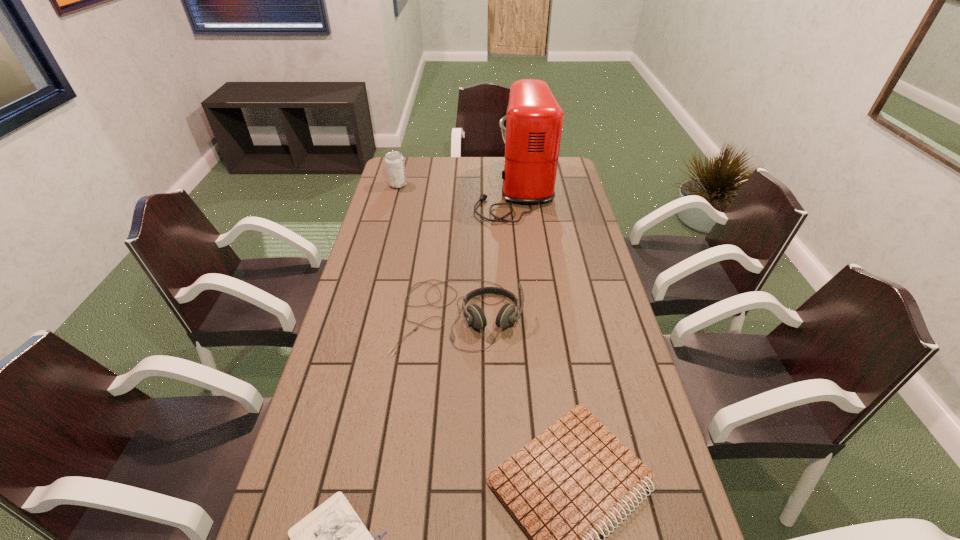
Identify the location of vacant space in between the third farthest object and the kitchen mixer. (487, 252).

The height and width of the screenshot is (540, 960). Find the location of `free spot between the third nearest object and the fourth shortest object`. free spot between the third nearest object and the fourth shortest object is located at coordinates (428, 250).

The image size is (960, 540). I want to click on empty space that is in between the fourth shortest object and the kitchen mixer, so click(x=456, y=187).

Locate an element on the screen. Image resolution: width=960 pixels, height=540 pixels. object that ranks as the third closest to the shortest object is located at coordinates (531, 130).

Identify which object is the fourth nearest to the kitchen mixer. Please provide its 2D coordinates. Your answer should be formatted as a tuple, i.e. [(x, y)], where the tuple contains the x and y coordinates of a point satisfying the conditions above.

[(332, 539)]